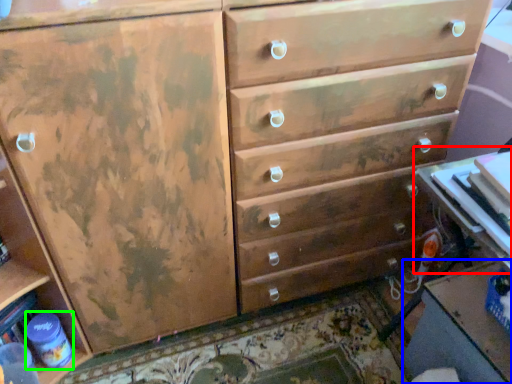
Question: Which object is the farthest from table (highlighted by a red box)? Choose among these: table (highlighted by a blue box) or bottle (highlighted by a green box).

Choices:
 (A) table
 (B) bottle

Answer: (B)